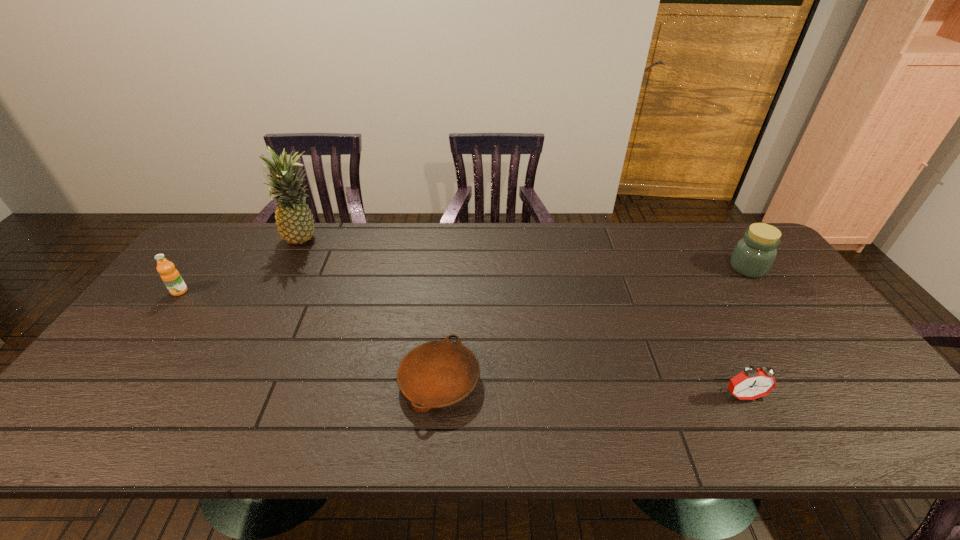
Where is `unoccupied position between the rightmost object and the third object from right to left`? unoccupied position between the rightmost object and the third object from right to left is located at coordinates (593, 325).

Find the location of a particular element. free area in between the plate and the second object from right to left is located at coordinates (591, 388).

Locate an element on the screen. The image size is (960, 540). free space between the fourth tallest object and the pineapple is located at coordinates (523, 318).

This screenshot has height=540, width=960. I want to click on free point between the second object from right to left and the jar, so click(745, 332).

Point out which object is positioned as the nearest to the orange juice. Please provide its 2D coordinates. Your answer should be formatted as a tuple, i.e. [(x, y)], where the tuple contains the x and y coordinates of a point satisfying the conditions above.

[(294, 220)]

Where is `the second closest object relative to the jar`? the second closest object relative to the jar is located at coordinates (436, 374).

I want to click on free space that satisfies the following two spatial constraints: 1. on the label of the third farthest object; 2. on the left side of the shortest object, so pos(112,381).

Image resolution: width=960 pixels, height=540 pixels. I want to click on free point that satisfies the following two spatial constraints: 1. on the back side of the jar; 2. on the left side of the plate, so click(449, 268).

Locate an element on the screen. The width and height of the screenshot is (960, 540). vacant space that satisfies the following two spatial constraints: 1. on the back side of the shortest object; 2. on the right side of the rightmost object is located at coordinates tap(449, 268).

Identify the location of vacant area that satisfies the following two spatial constraints: 1. on the label of the third nearest object; 2. on the right side of the shortest object. (112, 381).